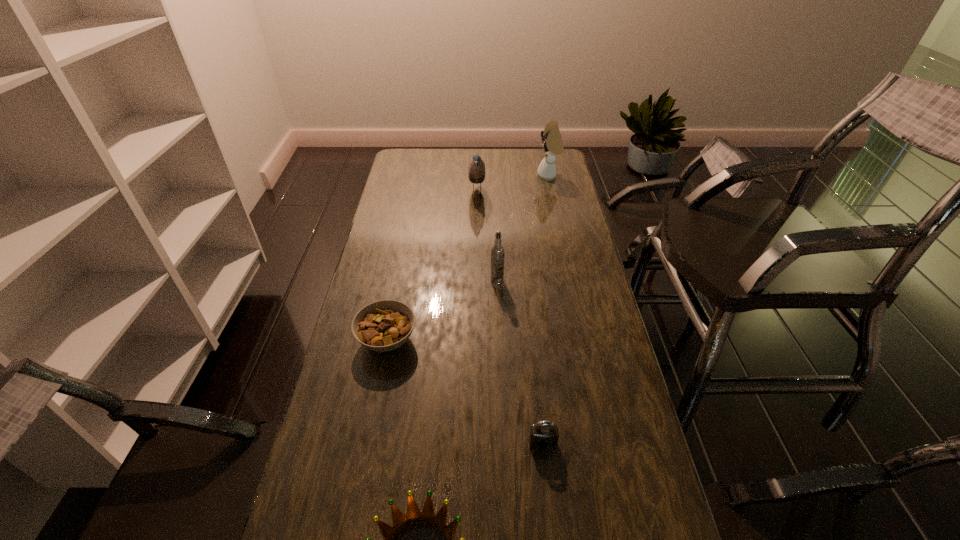
Image resolution: width=960 pixels, height=540 pixels. Identify the location of the tallest object. coord(552,144).

Where is `doll`? This screenshot has width=960, height=540. doll is located at coordinates (552, 144).

This screenshot has height=540, width=960. What are the coordinates of `the third farthest object` in the screenshot? It's located at (497, 252).

Where is `the fourth object from left to right`? This screenshot has width=960, height=540. the fourth object from left to right is located at coordinates 497,252.

At what (x,y) coordinates should I click in order to perform the action: click on bird. Please return your answer as a coordinate pair (x, y). This screenshot has height=540, width=960. Looking at the image, I should click on (476, 171).

Image resolution: width=960 pixels, height=540 pixels. Find the location of `the fifth object from left to right`. the fifth object from left to right is located at coordinates (544, 435).

Find the location of a particular element. This screenshot has width=960, height=540. the fifth farthest object is located at coordinates (544, 435).

Where is `the third nearest object`? The width and height of the screenshot is (960, 540). the third nearest object is located at coordinates (385, 325).

Find the location of `stew`. stew is located at coordinates (385, 325).

You are a GUI agent. You are given a task and a screenshot of the screen. Output one action in this format:
    pyautogui.click(x=<x>, y=<y>)
    Task: Click on the free location located 0.090m at the front face of the rightmost object
    
    Given the screenshot: What is the action you would take?
    pyautogui.click(x=517, y=176)